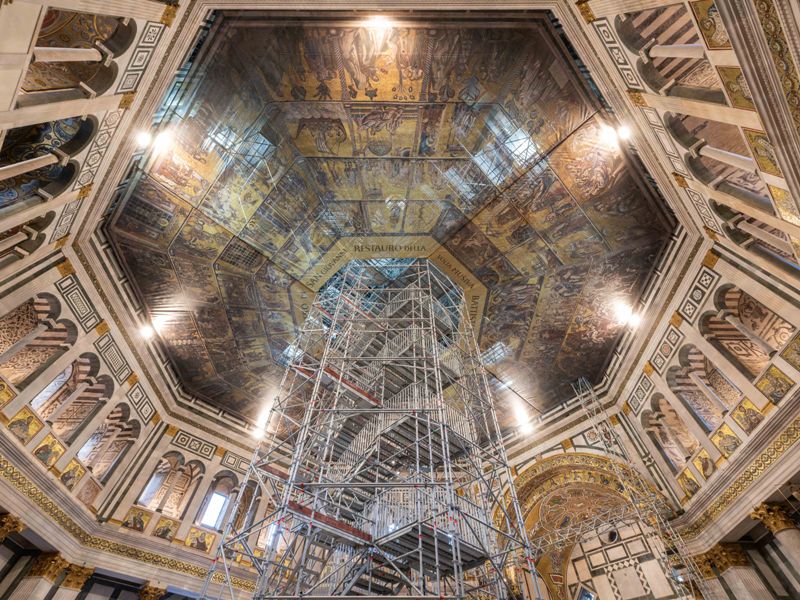
Image resolution: width=800 pixels, height=600 pixels. I want to click on ceiling, so click(369, 168).